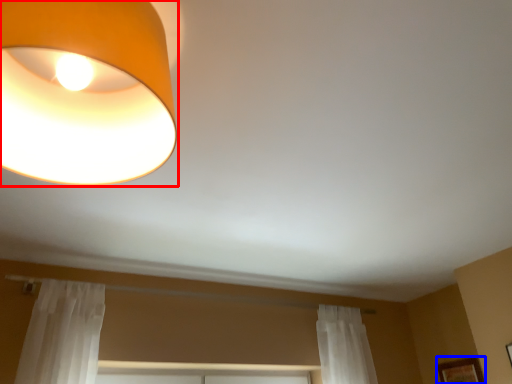
Question: Which point is further to the camera, lamp (highlighted by a red box) or picture frame (highlighted by a blue box)?

Choices:
 (A) lamp
 (B) picture frame

Answer: (B)